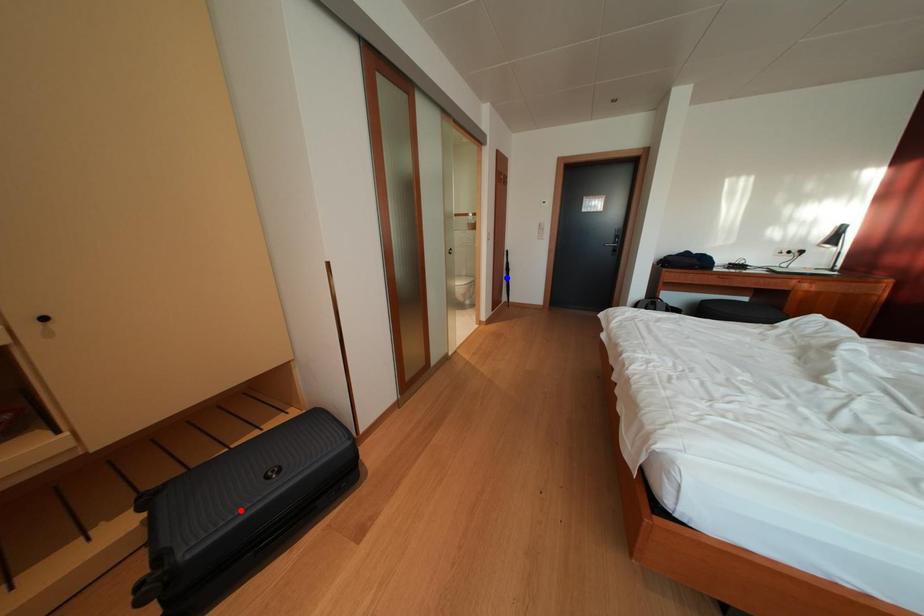
Question: In the image, two points are highlighted. Which point is nearer to the camera? Reply with the corresponding letter.

Choices:
 (A) blue point
 (B) red point

Answer: (B)